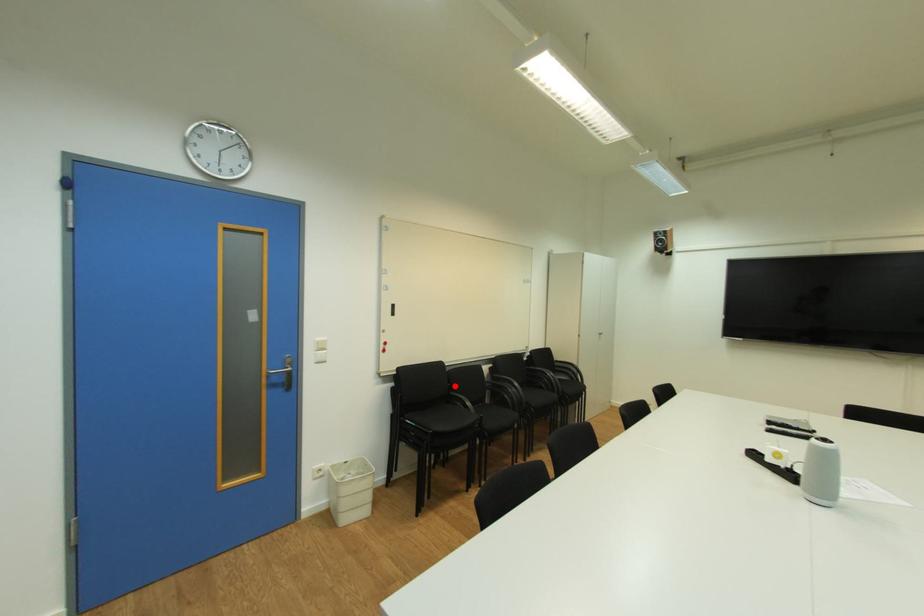
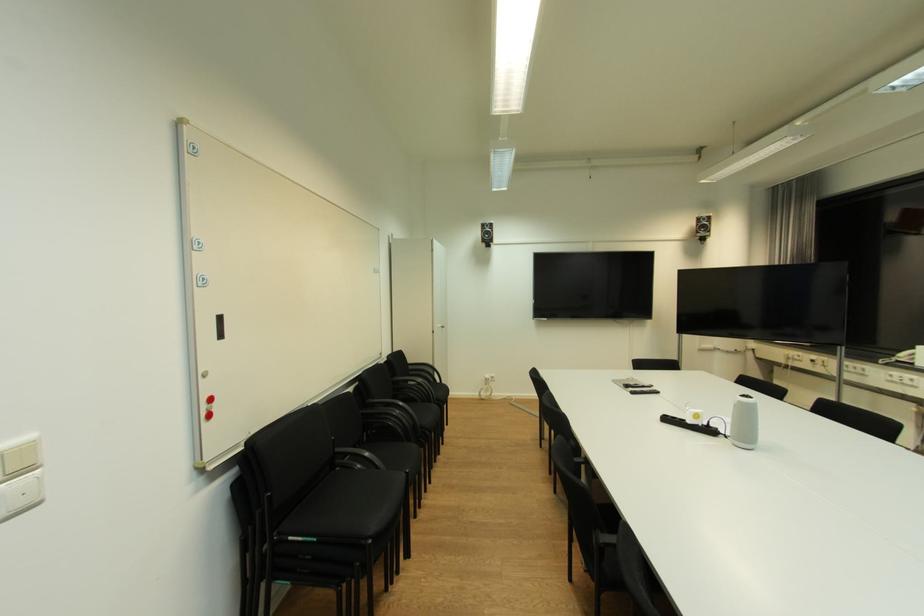
Where in the second image is the point corresponding to the highlighted location from the first image?

(338, 439)